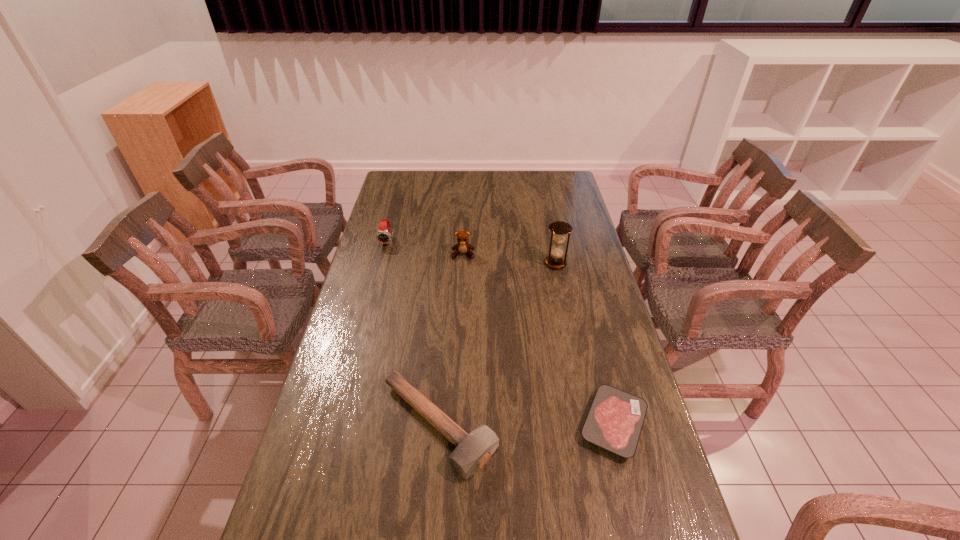
Find the location of `blank space located on the back of the shortest object`. blank space located on the back of the shortest object is located at coordinates (588, 319).

Locate an element on the screen. object that is at the left edge is located at coordinates coord(383,236).

Identify the location of hourglass that is at the right edge. (559, 229).

Find the location of a particular element. This screenshot has width=960, height=540. steak positioned at the right edge is located at coordinates (614, 422).

In order to click on vacant space at the far edge of the desktop in this screenshot , I will do `click(444, 181)`.

This screenshot has width=960, height=540. Find the location of `vacant space at the left edge of the desktop`. vacant space at the left edge of the desktop is located at coordinates (383, 293).

In the image, there is a desktop. Where is `free space at the right edge`? The width and height of the screenshot is (960, 540). free space at the right edge is located at coordinates click(576, 272).

Find the location of `vacant space at the far left corner of the desktop`. vacant space at the far left corner of the desktop is located at coordinates (421, 172).

The width and height of the screenshot is (960, 540). In order to click on vacant space at the far right corner in this screenshot , I will do `click(551, 183)`.

You are a GUI agent. You are given a task and a screenshot of the screen. Output one action in this format:
    pyautogui.click(x=<x>, y=<y>)
    Task: Click on the vacant area between the shortest object and the teddy bear
    This screenshot has height=540, width=960.
    Given the screenshot: What is the action you would take?
    pyautogui.click(x=539, y=339)